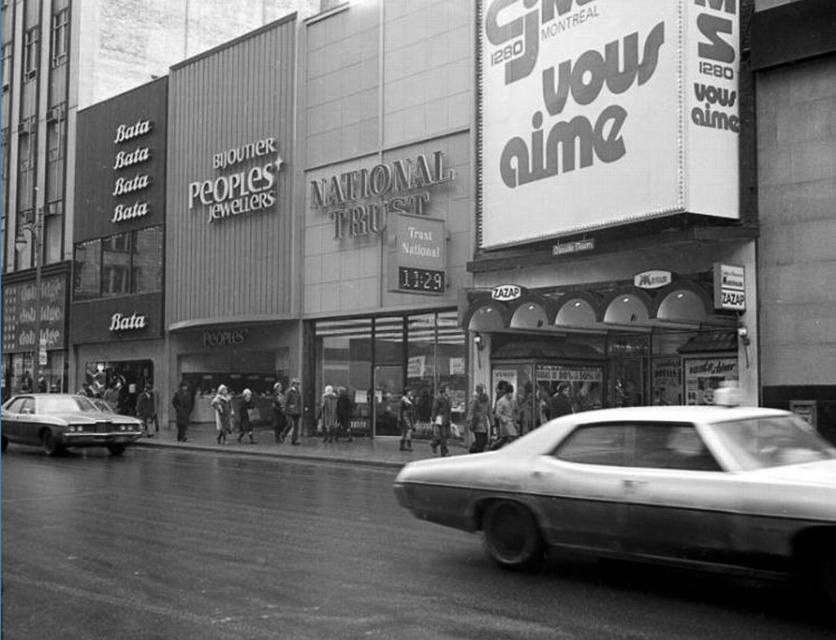
Question: Which point is closer to the camera taking this photo?

Choices:
 (A) (798, 568)
 (B) (72, 412)

Answer: (A)

Question: Is shiny white car at center below shiny chrome sedan at left?

Choices:
 (A) no
 (B) yes

Answer: (A)

Question: Which object appears closest to the camera in this image?

Choices:
 (A) shiny white car at center
 (B) shiny chrome sedan at left

Answer: (A)

Question: Can you confirm if shiny white car at center is bigger than shiny chrome sedan at left?

Choices:
 (A) no
 (B) yes

Answer: (A)

Question: In this image, where is shiny white car at center located relative to shiny chrome sedan at left?

Choices:
 (A) below
 (B) above

Answer: (B)